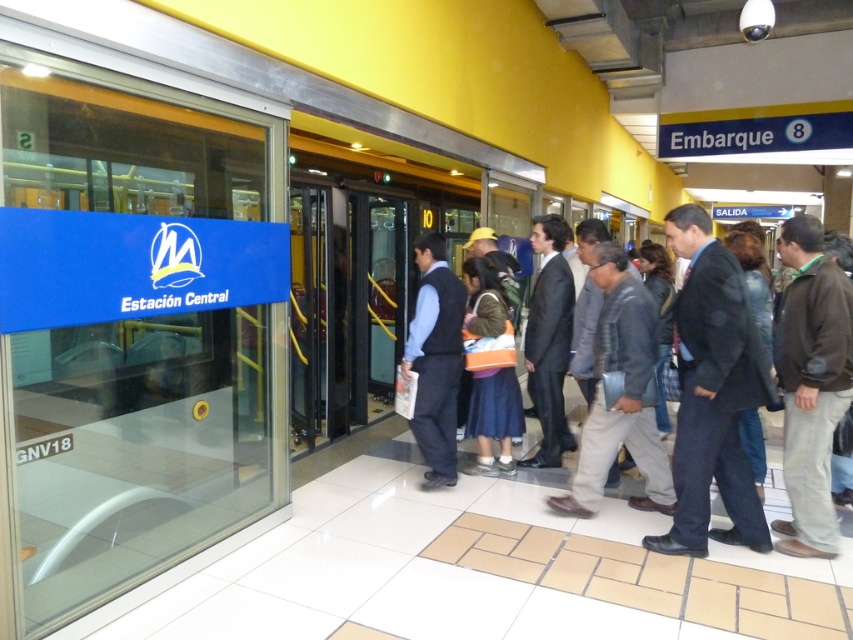
You are a photographer positioned at the entrance of the Estacion Central station. You want to take a photo of the dark gray suit at center and the dark blue suit at center. Which of the two suits is positioned more to the left side of the image?

The dark gray suit at center is positioned more to the left side of the image than the dark blue suit at center.

You are at the train station and need to find a person wearing a dark gray suit at center. There is also a person in a dark blue suit at center. Which one is larger in size?

The dark gray suit at center is bigger than the dark blue suit at center.